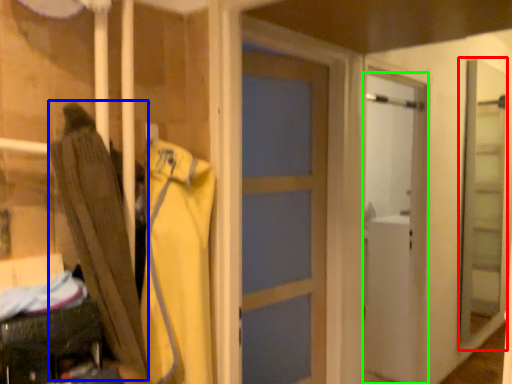
Question: Which is farther away from screen door (highlighted by a red box)? umbrella (highlighted by a blue box) or door (highlighted by a green box)?

Choices:
 (A) umbrella
 (B) door

Answer: (A)